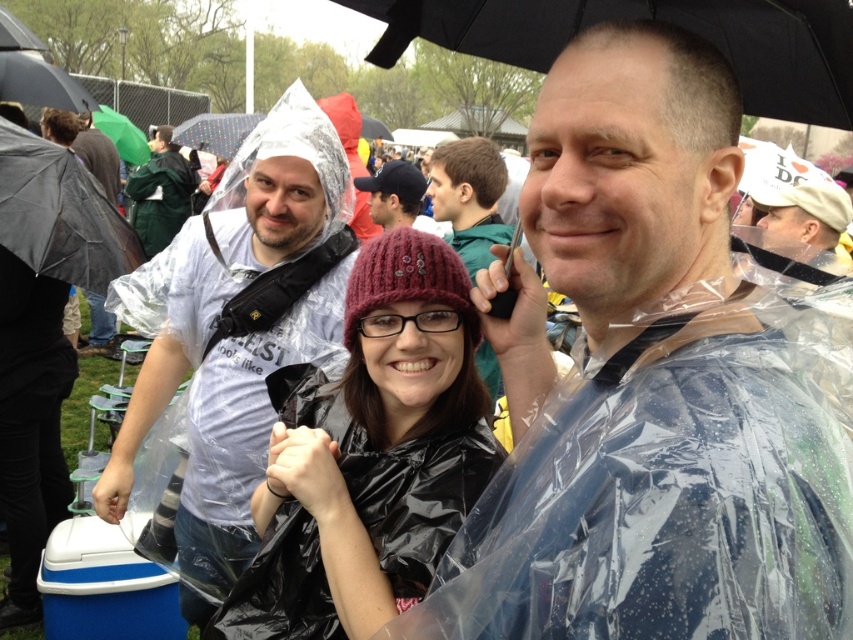
In the scene shown: You are a photographer trying to capture a clear shot of the white fabric hat at upper right and the transparent plastic umbrella at upper center. Since the sky is overcast, you need to adjust your camera settings. Which object should you focus on first to ensure proper exposure?

The white fabric hat at upper right should be focused on first because it is located below the transparent plastic umbrella at upper center, meaning it might be in shadow and require different exposure settings.

You are standing in the middle of the scene and want to move towards the closest point between point (67, 253) and point (144, 164). Which point should you walk towards?

Point (67, 253) is closer to the viewer than point (144, 164), so you should walk towards point (67, 253).

You are a photographer at the event and want to capture both the transparent plastic poncho at center and the transparent plastic poncho at left in a single shot. Which poncho should you focus on first to ensure both are in frame?

The transparent plastic poncho at center is positioned on the right side of the transparent plastic poncho at left, so you should focus on the transparent plastic poncho at left first to ensure both are in frame.